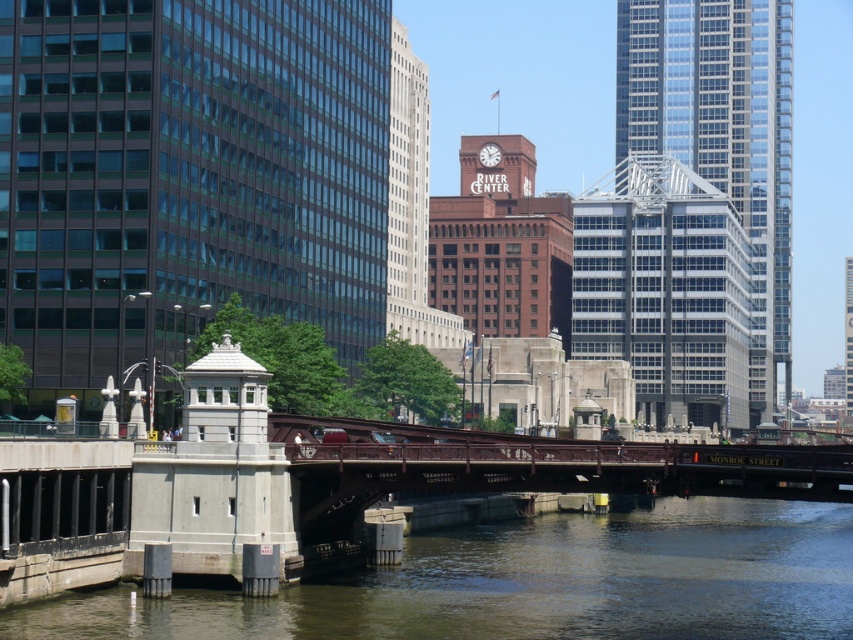
You are an architect analyzing the urban layout. Which object occupies a more prominent position in the scene, the glassy reflective skyscraper at upper right or the white glossy clock at center?

The glassy reflective skyscraper at upper right is larger in size than the white glossy clock at center, making it more prominent in the scene.

What is located at the coordinates point (x=721, y=136)?

The point (x=721, y=136) is where the glassy reflective skyscraper at upper right is located.

You are standing at the water edge and want to take a photo of the matte glass building at left. If your camera can focus on objects up to 100 meters away, will you be able to capture it clearly?

The matte glass building at left is 84.70 meters from viewer, so yes, the camera can focus on it since the distance is within the 100 meters range.